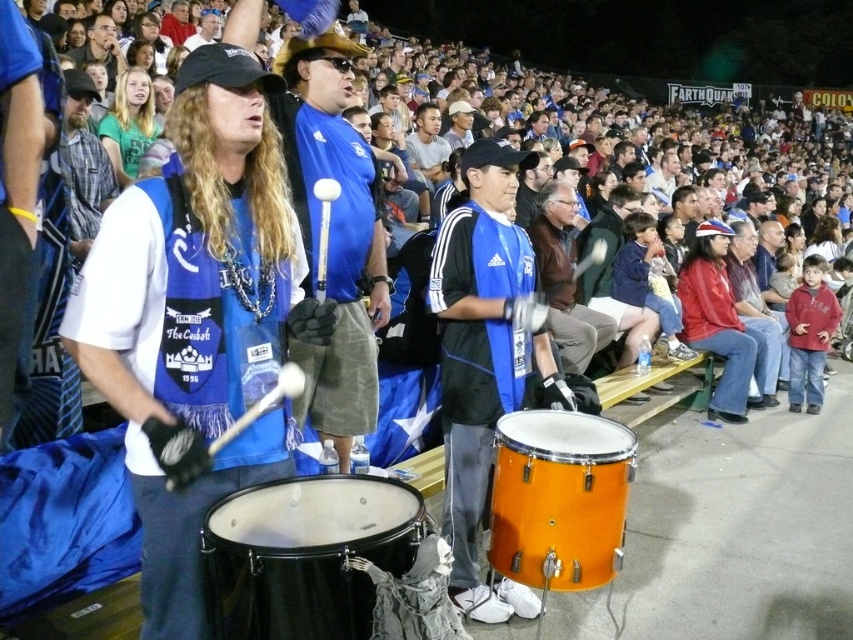
You are standing in the middle of the soccer field and want to move towards the two points marked in the image. Which point, point (401, 509) or point (111, 33), is closer to you?

Point (401, 509) is closer to the viewer than point (111, 33).

You are a photographer at the soccer match and want to capture both the orange wood drum at center and the light brown hair at upper center in a single photo. Which object should you focus on first to ensure both are in frame?

The orange wood drum at center is smaller than the light brown hair at upper center, so you should focus on the light brown hair at upper center first to ensure both fit in the frame.